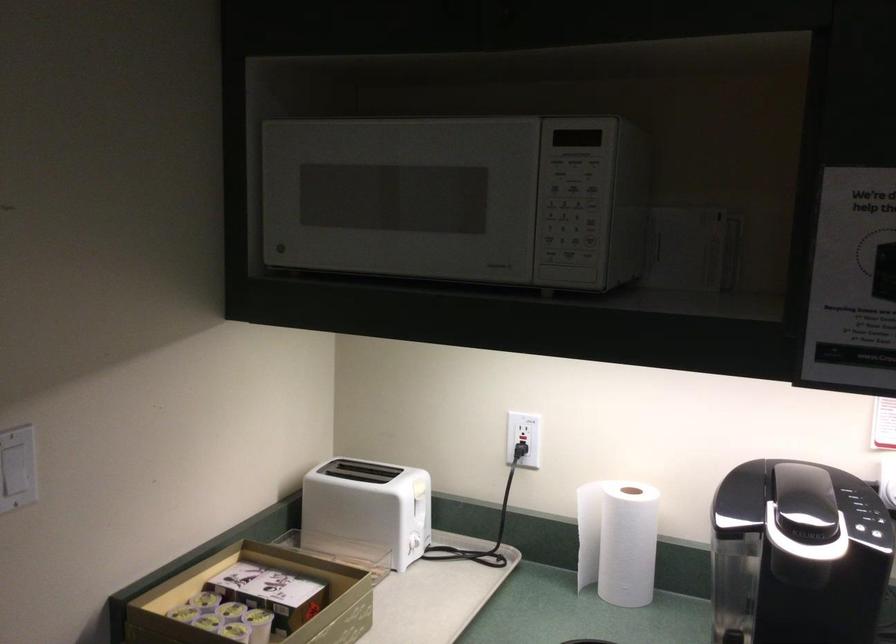
This screenshot has width=896, height=644. Find the location of `white light switch`. white light switch is located at coordinates (16, 460).